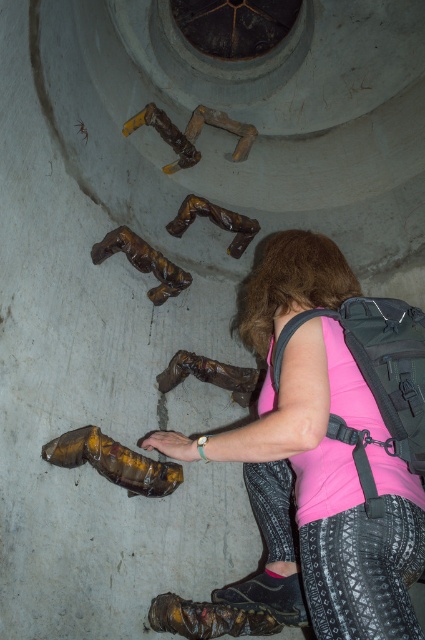
Question: Is matte black backpack at center to the right of leather glove at lower center from the viewer's perspective?

Choices:
 (A) no
 (B) yes

Answer: (B)

Question: Does pink fabric backpack at lower center come behind leather glove at lower center?

Choices:
 (A) yes
 (B) no

Answer: (B)

Question: Estimate the real-world distances between objects in this image. Which object is farther from the matte black backpack at center?

Choices:
 (A) pink fabric backpack at lower center
 (B) leather glove at lower center

Answer: (B)

Question: Estimate the real-world distances between objects in this image. Which object is farther from the leather glove at lower center?

Choices:
 (A) matte black backpack at center
 (B) pink fabric backpack at lower center

Answer: (A)

Question: Is pink fabric backpack at lower center smaller than matte black backpack at center?

Choices:
 (A) yes
 (B) no

Answer: (B)

Question: Which point appears farthest from the camera in this image?

Choices:
 (A) (187, 436)
 (B) (334, 364)
 (C) (397, 340)

Answer: (A)